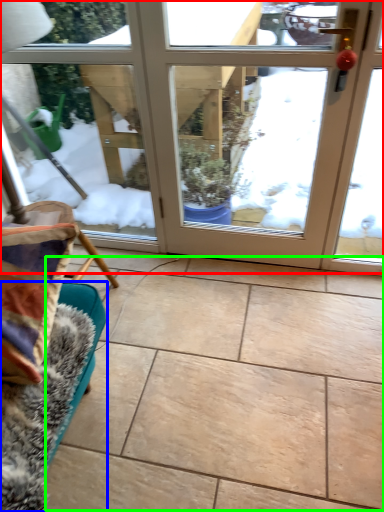
Question: Estimate the real-world distances between objects in this image. Which object is farther from door (highlighted by a red box), furniture (highlighted by a blue box) or ceramic tile (highlighted by a green box)?

Choices:
 (A) furniture
 (B) ceramic tile

Answer: (A)